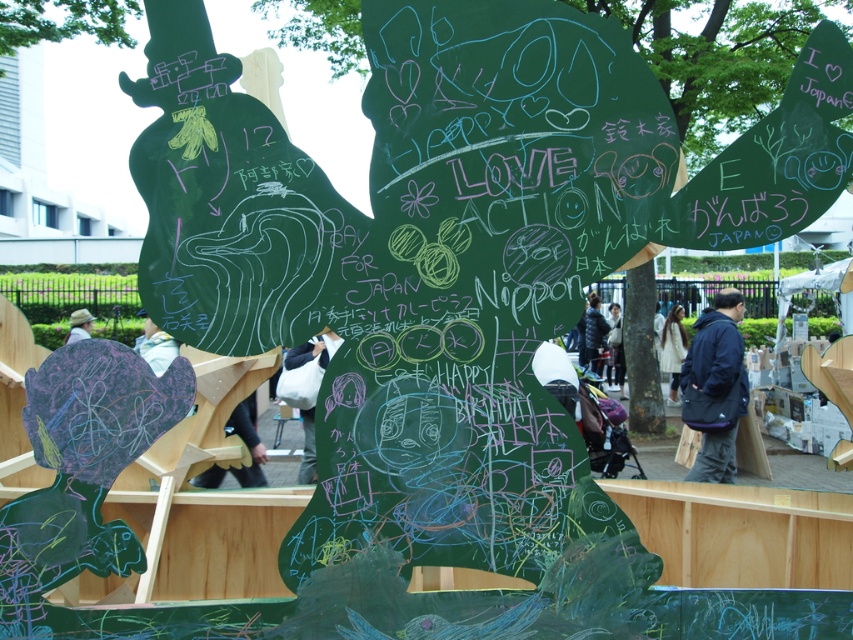
You are organizing an outdoor event and need to cover the green board with a fabric. You have a white fabric at center and a light brown straw hat at lower left. Which fabric is wider and suitable for covering the board?

The light brown straw hat at lower left is wider than the white fabric at center, so it would be more suitable for covering the board.

You are standing in front of the green chalkboard in the park. You see a dark blue jacket at center. If you want to reach the jacket without moving your position, is it possible?

The dark blue jacket at center is 12.08 meters away from viewer, so you cannot reach it without moving your position since it is too far.

You are standing in front of the green chalkboard and notice the white fabric at center and the dark blue jacket at center. Which object is taller?

The white fabric at center is taller than the dark blue jacket at center.